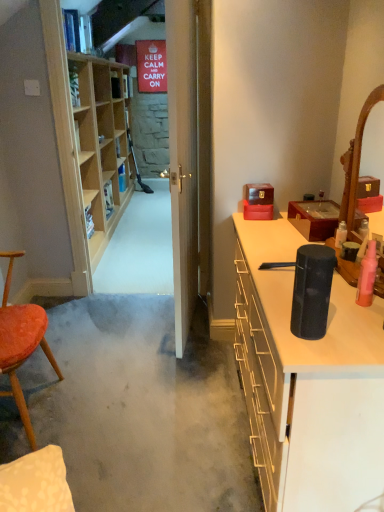
Question: From the image's perspective, does wooden jewelry box at upper right, which appears as the first cabinetry when viewed from the top, appear higher than black matte speaker at right, the second cabinetry positioned from the top?

Choices:
 (A) yes
 (B) no

Answer: (A)

Question: Does wooden jewelry box at upper right, the second cabinetry positioned from the bottom, appear on the right side of black matte speaker at right, the second cabinetry positioned from the top?

Choices:
 (A) no
 (B) yes

Answer: (B)

Question: Are wooden jewelry box at upper right, the second cabinetry positioned from the bottom, and black matte speaker at right, the second cabinetry positioned from the top, far apart?

Choices:
 (A) yes
 (B) no

Answer: (B)

Question: Is the position of wooden jewelry box at upper right, which appears as the first cabinetry when viewed from the top, more distant than that of black matte speaker at right, the second cabinetry positioned from the top?

Choices:
 (A) no
 (B) yes

Answer: (B)

Question: Considering the relative sizes of wooden jewelry box at upper right, which appears as the first cabinetry when viewed from the top, and black matte speaker at right, the second cabinetry positioned from the top, in the image provided, is wooden jewelry box at upper right, which appears as the first cabinetry when viewed from the top, thinner than black matte speaker at right, the second cabinetry positioned from the top,?

Choices:
 (A) no
 (B) yes

Answer: (B)

Question: From a real-world perspective, is wooden jewelry box at upper right, the second cabinetry positioned from the bottom, on top of black matte speaker at right, the first cabinetry in the bottom-to-top sequence?

Choices:
 (A) no
 (B) yes

Answer: (B)

Question: Can you confirm if pink matte bottle at right is smaller than black matte speaker at right, the second cabinetry positioned from the top?

Choices:
 (A) no
 (B) yes

Answer: (B)

Question: Is pink matte bottle at right located outside black matte speaker at right, the second cabinetry positioned from the top?

Choices:
 (A) no
 (B) yes

Answer: (B)

Question: Does pink matte bottle at right have a greater width compared to black matte speaker at right, the second cabinetry positioned from the top?

Choices:
 (A) no
 (B) yes

Answer: (A)

Question: From the image's perspective, would you say pink matte bottle at right is shown under black matte speaker at right, the first cabinetry in the bottom-to-top sequence?

Choices:
 (A) yes
 (B) no

Answer: (B)

Question: From a real-world perspective, is pink matte bottle at right under black matte speaker at right, the first cabinetry in the bottom-to-top sequence?

Choices:
 (A) no
 (B) yes

Answer: (A)

Question: Is pink matte bottle at right facing away from black matte speaker at right, the second cabinetry positioned from the top?

Choices:
 (A) yes
 (B) no

Answer: (B)

Question: Would you say wooden mirror at right is outside wooden jewelry box at upper right, the second cabinetry positioned from the bottom?

Choices:
 (A) no
 (B) yes

Answer: (B)